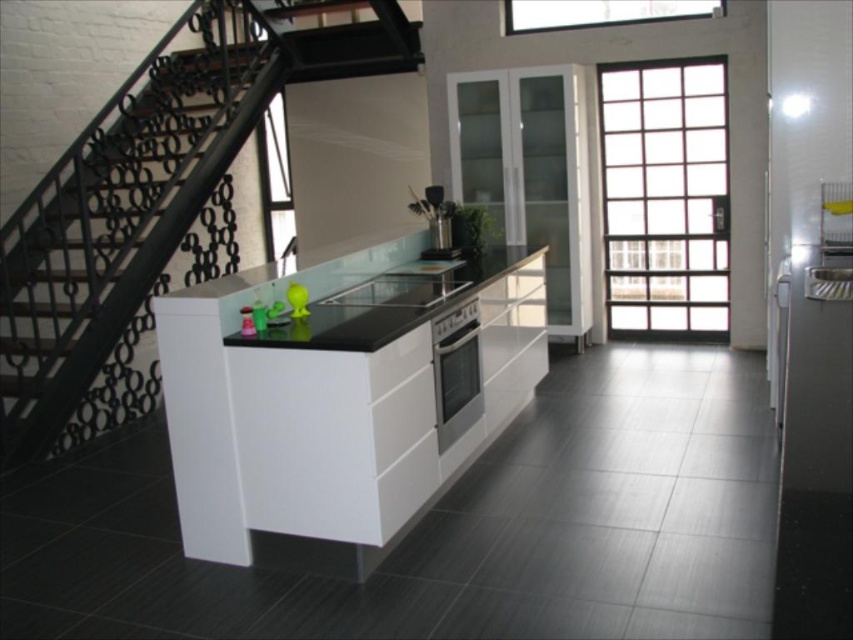
Question: Is black glossy counter top at center below metallic silver utensil holder at center?

Choices:
 (A) yes
 (B) no

Answer: (A)

Question: Which point is closer to the camera?

Choices:
 (A) (360, 296)
 (B) (210, 173)

Answer: (A)

Question: Does black metal stairs at left lie in front of metallic silver utensil holder at center?

Choices:
 (A) yes
 (B) no

Answer: (A)

Question: Does glossy black oven at center lie in front of metallic silver utensil holder at center?

Choices:
 (A) yes
 (B) no

Answer: (A)

Question: Which point is farther from the camera taking this photo?

Choices:
 (A) (360, 38)
 (B) (473, 404)
 (C) (457, 349)

Answer: (A)

Question: Which object is positioned farthest from the metallic silver utensil holder at center?

Choices:
 (A) black glossy counter top at center
 (B) satin silver oven at center
 (C) glossy black oven at center

Answer: (A)